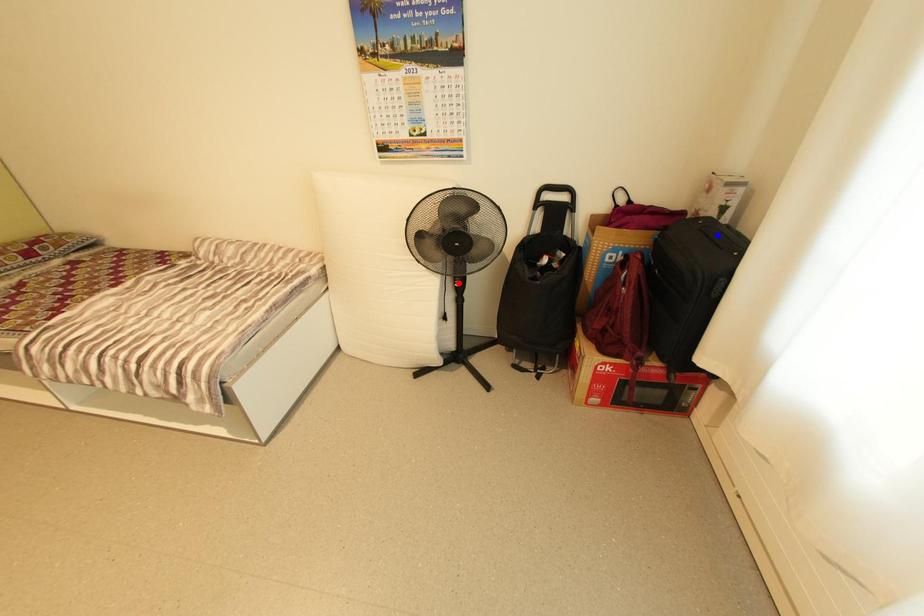
Question: In the image, two points are highlighted. Which point is nearer to the camera? Reply with the corresponding letter.

Choices:
 (A) blue point
 (B) red point

Answer: (A)